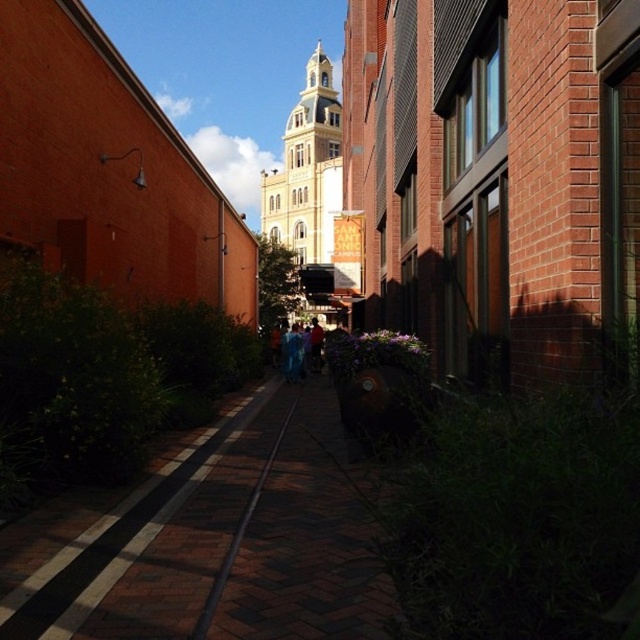
Question: Can you confirm if yellow matte building at center is smaller than black metal train track at center?

Choices:
 (A) no
 (B) yes

Answer: (A)

Question: Is brick pavement at center above black metal train track at center?

Choices:
 (A) yes
 (B) no

Answer: (A)

Question: Which point appears farthest from the camera in this image?

Choices:
 (A) (333, 173)
 (B) (224, 497)

Answer: (A)

Question: Which point appears closest to the camera in this image?

Choices:
 (A) (301, 339)
 (B) (328, 180)

Answer: (A)

Question: Which point is farther to the camera?

Choices:
 (A) blue fabric at center
 (B) yellow matte building at center
 (C) black metal train track at center

Answer: (B)

Question: Can you confirm if yellow matte building at center is positioned to the right of black metal train track at center?

Choices:
 (A) no
 (B) yes

Answer: (B)